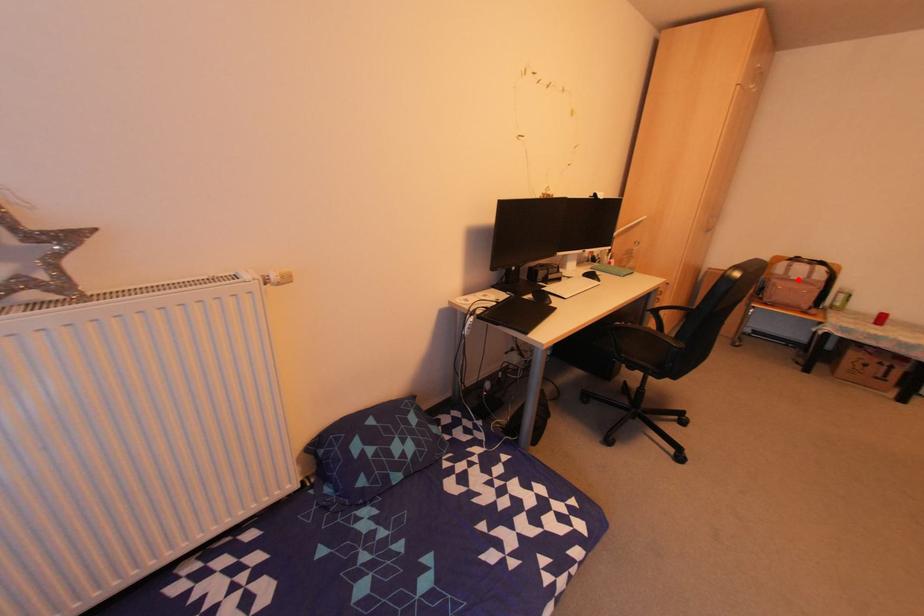
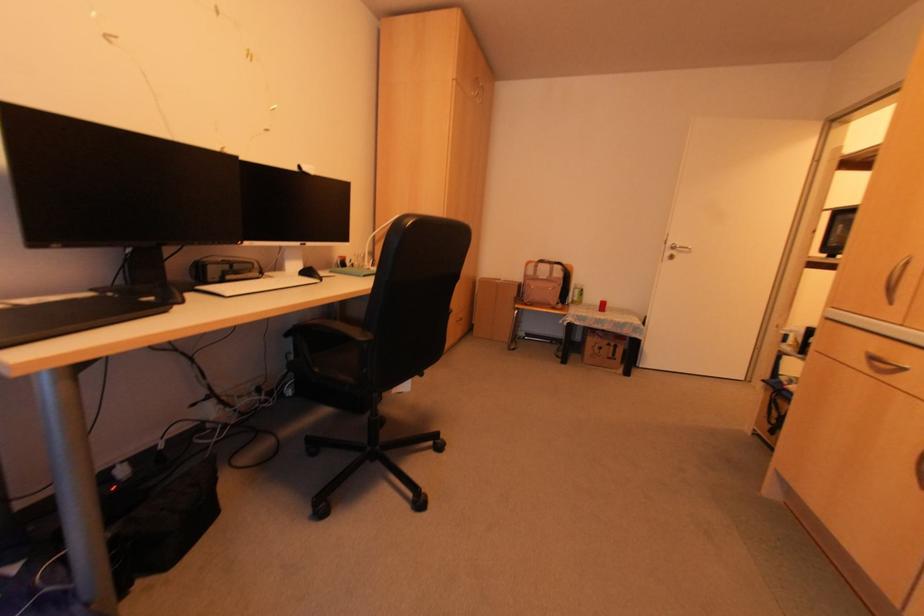
In the second image, find the point that corresponds to the highlighted location in the first image.

(542, 278)